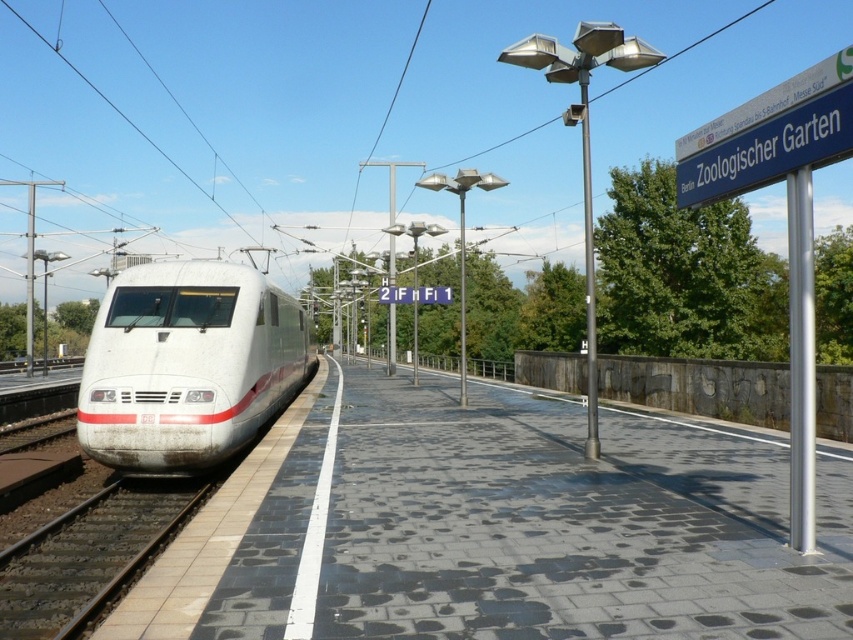
Is black textured platform at center closer to the viewer compared to white glossy bullet train at left?

Yes, it is.

Which is below, black textured platform at center or white glossy bullet train at left?

Positioned lower is black textured platform at center.

Which is in front, point (384, 456) or point (105, 401)?

Point (105, 401) is in front.

Identify the location of black textured platform at center. (x=495, y=529).

In the scene shown: How much distance is there between black textured platform at center and black asphalt train track at lower left?

black textured platform at center and black asphalt train track at lower left are 5.69 meters apart from each other.

Does black textured platform at center have a larger size compared to black asphalt train track at lower left?

Yes, black textured platform at center is bigger than black asphalt train track at lower left.

Locate an element on the screen. The width and height of the screenshot is (853, 640). black textured platform at center is located at coordinates (495, 529).

This screenshot has height=640, width=853. I want to click on black textured platform at center, so click(495, 529).

Who is positioned more to the right, white glossy bullet train at left or black asphalt train track at lower left?

black asphalt train track at lower left is more to the right.

Who is more forward, (114, 323) or (109, 499)?

Point (109, 499) is more forward.

Which is in front, point (215, 416) or point (19, 616)?

Point (19, 616)

Where is `white glossy bullet train at left`? Image resolution: width=853 pixels, height=640 pixels. white glossy bullet train at left is located at coordinates (187, 365).